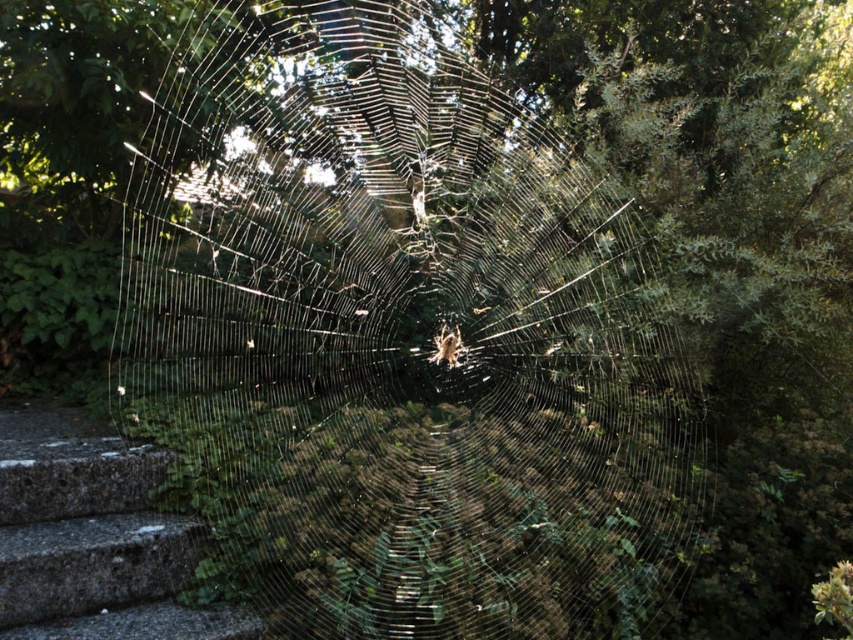
Question: In this image, where is transparent silk spider web at center located relative to brown fuzzy spider at center?

Choices:
 (A) right
 (B) left

Answer: (B)

Question: Is gray concrete stairs at lower left further to camera compared to brown fuzzy spider at center?

Choices:
 (A) no
 (B) yes

Answer: (A)

Question: Which object is closer to the camera taking this photo?

Choices:
 (A) brown fuzzy spider at center
 (B) transparent silk spider web at center

Answer: (B)

Question: Does gray concrete stairs at lower left appear under brown fuzzy spider at center?

Choices:
 (A) no
 (B) yes

Answer: (B)

Question: Which point is closer to the camera taking this photo?

Choices:
 (A) (460, 337)
 (B) (51, 481)

Answer: (B)

Question: Estimate the real-world distances between objects in this image. Which object is farther from the gray concrete stairs at lower left?

Choices:
 (A) brown fuzzy spider at center
 (B) transparent silk spider web at center

Answer: (A)